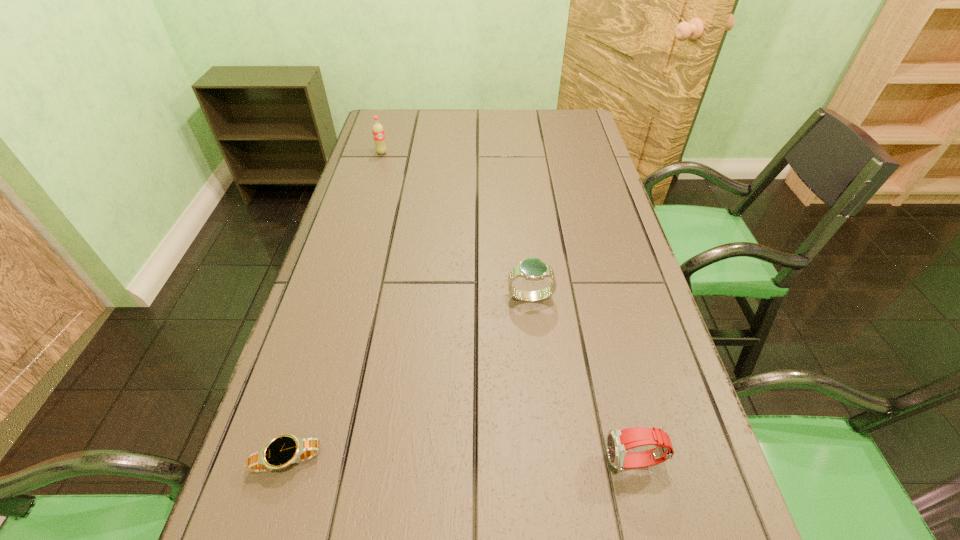
Point out which object is positioned as the nearest to the rightmost object. Please provide its 2D coordinates. Your answer should be formatted as a tuple, i.e. [(x, y)], where the tuple contains the x and y coordinates of a point satisfying the conditions above.

[(533, 269)]

You are a GUI agent. You are given a task and a screenshot of the screen. Output one action in this format:
    pyautogui.click(x=<x>, y=<y>)
    Task: Click on the watch that stands as the third closest to the tallest object
    
    Given the screenshot: What is the action you would take?
    pyautogui.click(x=619, y=441)

Where is `watch that is the closest to the rightmost watch`? The width and height of the screenshot is (960, 540). watch that is the closest to the rightmost watch is located at coordinates click(x=533, y=269).